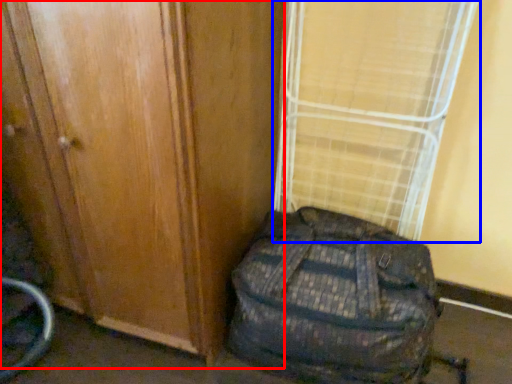
Question: Which of the following is the farthest to the observer, door (highlighted by a red box) or curtain (highlighted by a blue box)?

Choices:
 (A) door
 (B) curtain

Answer: (B)